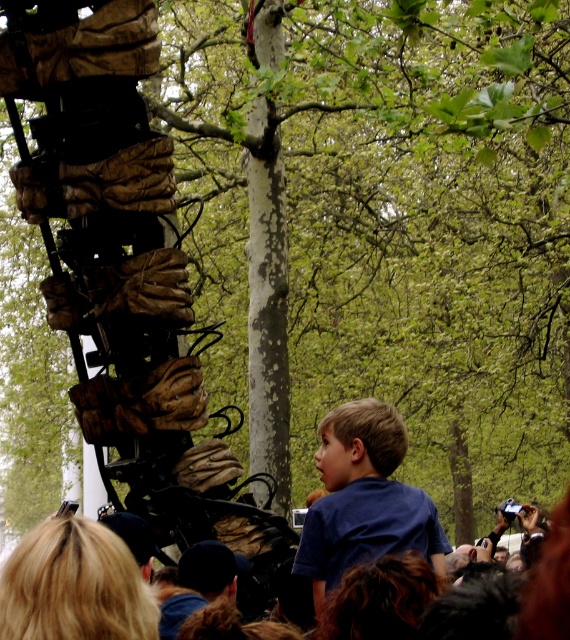
Does blue cotton shirt at center have a greater width compared to dark blue fabric cap at center?

Yes, blue cotton shirt at center is wider than dark blue fabric cap at center.

Is blue cotton shirt at center shorter than dark blue fabric cap at center?

No.

Where is `blue cotton shirt at center`? The height and width of the screenshot is (640, 570). blue cotton shirt at center is located at coordinates (364, 499).

Image resolution: width=570 pixels, height=640 pixels. I want to click on blue cotton shirt at center, so click(364, 499).